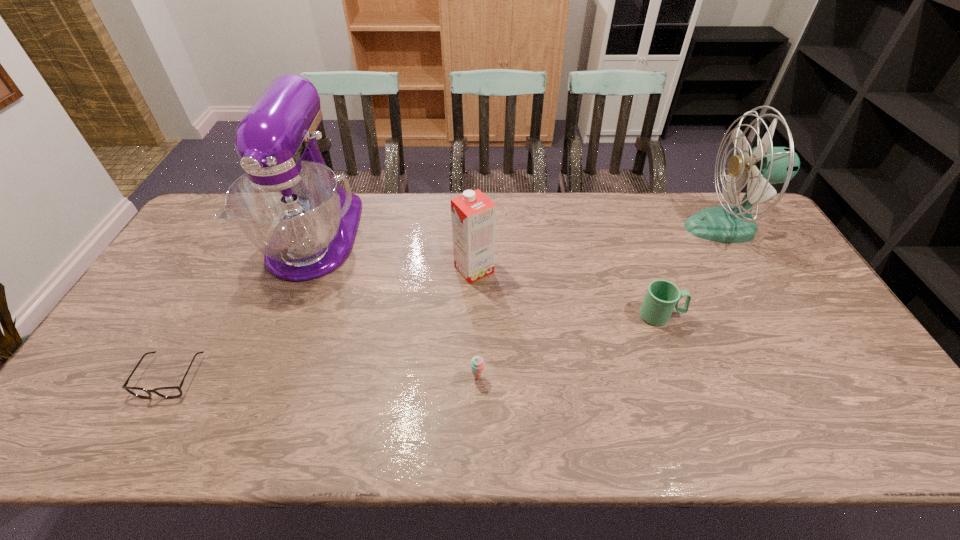
Where is `free location located 0.260m in front of the rightmost object, directing airflow`? The image size is (960, 540). free location located 0.260m in front of the rightmost object, directing airflow is located at coordinates (609, 228).

Find the location of a particular element. Image resolution: width=960 pixels, height=540 pixels. blank space located 0.310m in front of the rightmost object, directing airflow is located at coordinates (593, 228).

Identify the location of free space located on the back of the carton. (475, 194).

Where is `vacant area located on the side of the mug with the handle`? The height and width of the screenshot is (540, 960). vacant area located on the side of the mug with the handle is located at coordinates (780, 315).

Locate an element on the screen. vacant space located on the right of the sherbert is located at coordinates (517, 377).

Where is `mixer present at the far edge`? Image resolution: width=960 pixels, height=540 pixels. mixer present at the far edge is located at coordinates (288, 205).

Locate an element on the screen. This screenshot has height=540, width=960. fan located in the far edge section of the desktop is located at coordinates (764, 165).

In order to click on object situated at the left edge in this screenshot , I will do `click(166, 392)`.

I want to click on object that is at the right edge, so click(764, 165).

Where is `object present at the far right corner`? object present at the far right corner is located at coordinates (764, 165).